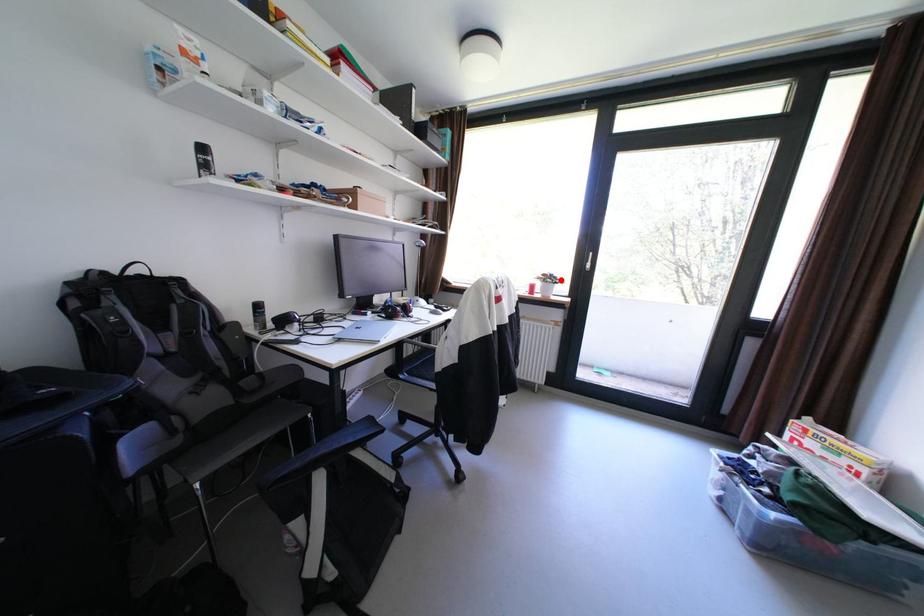
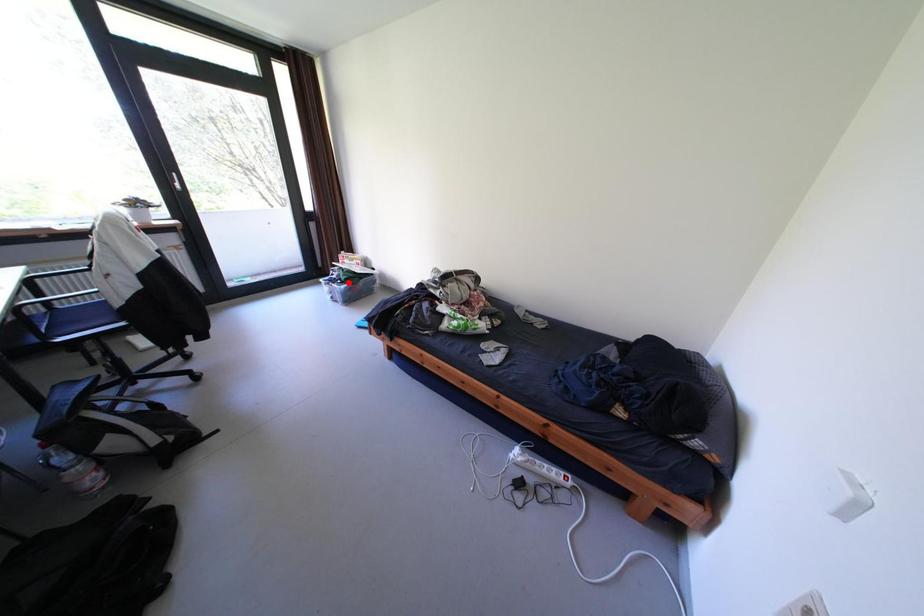
Looking at this image, I am providing you with two images of the same scene from different viewpoints. A red point is marked on the first image and another point is marked on the second image. Are the points marked in image1 and image2 representing the same 3D position?

No